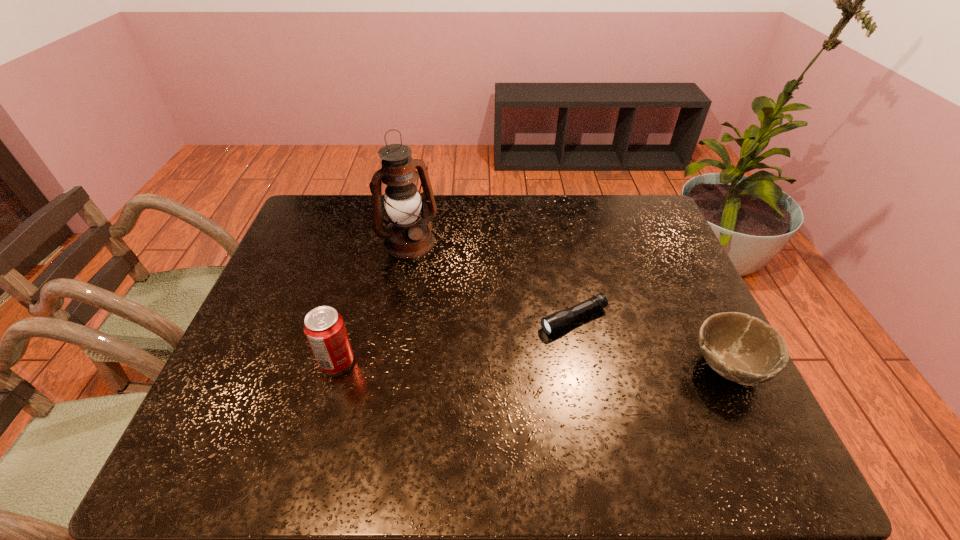
Image resolution: width=960 pixels, height=540 pixels. Find the location of `free area in between the soda and the rightmost object`. free area in between the soda and the rightmost object is located at coordinates (533, 364).

Identify the location of free space between the second tallest object and the farthest object. (372, 302).

Where is `empty space between the flashlight and the second tallest object`? empty space between the flashlight and the second tallest object is located at coordinates (455, 341).

The width and height of the screenshot is (960, 540). Find the location of `free space between the third shortest object and the flashlight`. free space between the third shortest object and the flashlight is located at coordinates (455, 341).

This screenshot has width=960, height=540. I want to click on vacant region between the third tallest object and the lantern, so click(568, 305).

Where is `object that stands as the closest to the rightmost object`? The height and width of the screenshot is (540, 960). object that stands as the closest to the rightmost object is located at coordinates (552, 323).

Find the location of a particular element. The width and height of the screenshot is (960, 540). the third closest object to the tallest object is located at coordinates (743, 349).

Identify the location of vacant point that satisfies the following two spatial constraints: 1. on the front side of the third shortest object; 2. on the right side of the bowl. The height and width of the screenshot is (540, 960). (336, 367).

In order to click on blank area in the image that satisfies the following two spatial constraints: 1. on the front side of the bowl; 2. on the right side of the second object from right to left in this screenshot , I will do click(584, 367).

The width and height of the screenshot is (960, 540). What are the coordinates of `vacant space that satisfies the following two spatial constraints: 1. on the front side of the lantern; 2. on the left side of the third object from left to right` in the screenshot? It's located at (394, 319).